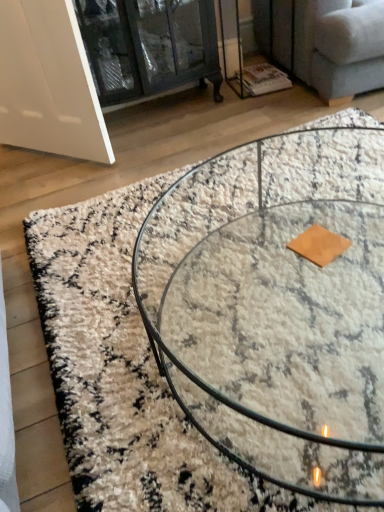
Find the location of `free space on the front side of clear glass cabinet at upper left`. free space on the front side of clear glass cabinet at upper left is located at coordinates (147, 146).